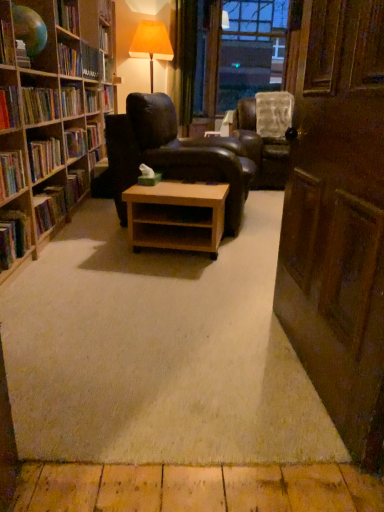
Question: Is wooden bookshelf at left bigger than hardcover book at upper left, the 1th book when ordered from top to bottom?

Choices:
 (A) no
 (B) yes

Answer: (B)

Question: Is wooden bookshelf at left closer to the viewer compared to hardcover book at upper left, marked as the fifth book in a front-to-back arrangement?

Choices:
 (A) yes
 (B) no

Answer: (A)

Question: Considering the relative sizes of wooden bookshelf at left and hardcover book at upper left, the 1th book when ordered from top to bottom, in the image provided, is wooden bookshelf at left wider than hardcover book at upper left, the 1th book when ordered from top to bottom,?

Choices:
 (A) no
 (B) yes

Answer: (B)

Question: Would you say wooden bookshelf at left is outside hardcover book at upper left, placed as the second book when sorted from back to front?

Choices:
 (A) no
 (B) yes

Answer: (B)

Question: Is wooden bookshelf at left directly adjacent to hardcover book at upper left, marked as the fifth book in a front-to-back arrangement?

Choices:
 (A) no
 (B) yes

Answer: (A)

Question: Is hardcover book at upper left, marked as the fifth book in a bottom-to-top arrangement, inside the boundaries of hardcover book at left, placed as the second book when sorted from bottom to top, or outside?

Choices:
 (A) outside
 (B) inside

Answer: (A)

Question: Relative to hardcover book at left, which is the fourth book in front-to-back order, is hardcover book at upper left, positioned as the second book in top-to-bottom order, in front or behind?

Choices:
 (A) front
 (B) behind

Answer: (B)

Question: Based on their positions, is hardcover book at upper left, marked as the fifth book in a bottom-to-top arrangement, located to the left or right of hardcover book at left, acting as the 3th book starting from the back?

Choices:
 (A) left
 (B) right

Answer: (A)

Question: From a real-world perspective, is hardcover book at upper left, marked as the 1th book in a back-to-front arrangement, physically located above or below hardcover book at left, marked as the fifth book in a top-to-bottom arrangement?

Choices:
 (A) below
 (B) above

Answer: (B)

Question: In terms of height, does transparent plastic window screen at upper center look taller or shorter compared to hardcover book at left, the third book from the top?

Choices:
 (A) tall
 (B) short

Answer: (A)

Question: From the image's perspective, is transparent plastic window screen at upper center above or below hardcover book at left, the fourth book when ordered from bottom to top?

Choices:
 (A) above
 (B) below

Answer: (A)

Question: Considering the positions of transparent plastic window screen at upper center and hardcover book at left, which is counted as the 3th book, starting from the front, in the image, is transparent plastic window screen at upper center wider or thinner than hardcover book at left, which is counted as the 3th book, starting from the front,?

Choices:
 (A) thin
 (B) wide

Answer: (B)

Question: Considering the positions of transparent plastic window screen at upper center and hardcover book at left, which is counted as the 4th book, starting from the back, in the image, is transparent plastic window screen at upper center bigger or smaller than hardcover book at left, which is counted as the 4th book, starting from the back,?

Choices:
 (A) big
 (B) small

Answer: (A)

Question: Considering the positions of hardcover book at left, acting as the 3th book starting from the back, and transparent plastic window screen at upper center in the image, is hardcover book at left, acting as the 3th book starting from the back, taller or shorter than transparent plastic window screen at upper center?

Choices:
 (A) short
 (B) tall

Answer: (A)

Question: In the image, is hardcover book at left, placed as the second book when sorted from bottom to top, on the left side or the right side of transparent plastic window screen at upper center?

Choices:
 (A) right
 (B) left

Answer: (B)